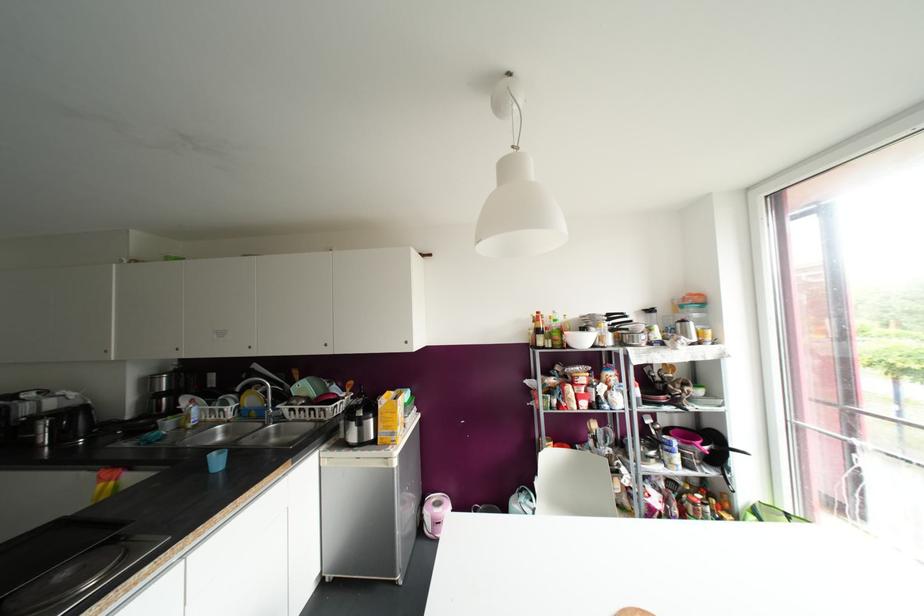
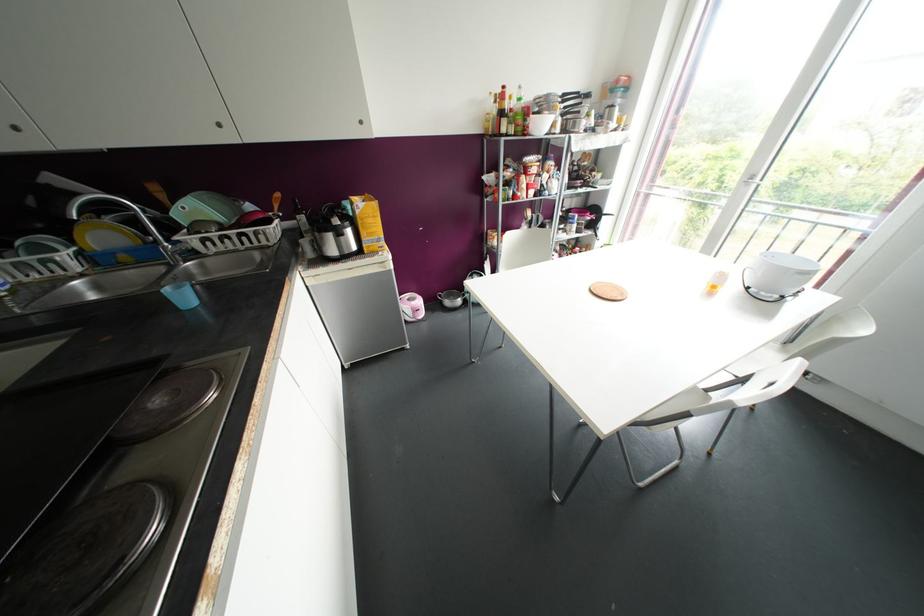
Find the pixel in the second image that matches pixel 324 344 in the first image.

(219, 124)